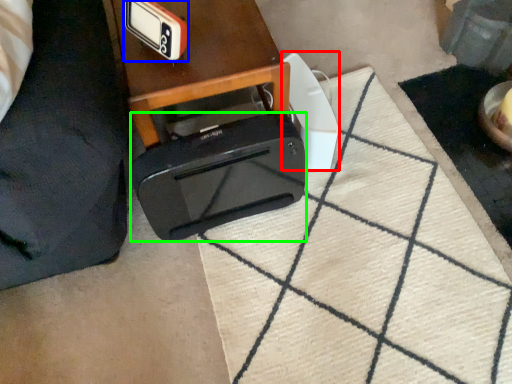
Question: Considering the real-world distances, which object is closest to appliance (highlighted by a red box)? gadget (highlighted by a blue box) or toaster (highlighted by a green box).

Choices:
 (A) gadget
 (B) toaster

Answer: (B)